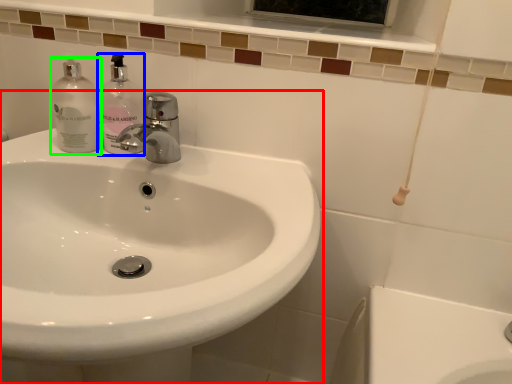
Question: Considering the real-world distances, which object is closest to sink (highlighted by a red box)? soap dispenser (highlighted by a blue box) or cleaning product (highlighted by a green box).

Choices:
 (A) soap dispenser
 (B) cleaning product

Answer: (A)